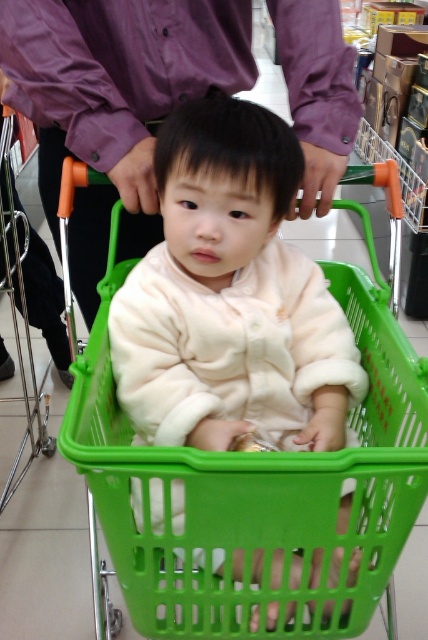
How far apart are soft beige baby at center and purple cotton shirt at upper center?

The distance of soft beige baby at center from purple cotton shirt at upper center is 24.36 centimeters.

Can you confirm if soft beige baby at center is smaller than purple cotton shirt at upper center?

Indeed, soft beige baby at center has a smaller size compared to purple cotton shirt at upper center.

Between point (113, 321) and point (288, 42), which one is positioned in front?

Point (113, 321) is in front.

I want to click on soft beige baby at center, so click(x=231, y=298).